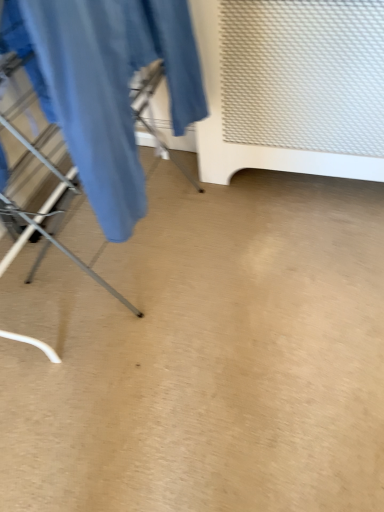
Find the location of `vacant area situated below white textured radiator at upper right (from a real-world perspective)`. vacant area situated below white textured radiator at upper right (from a real-world perspective) is located at coordinates (293, 183).